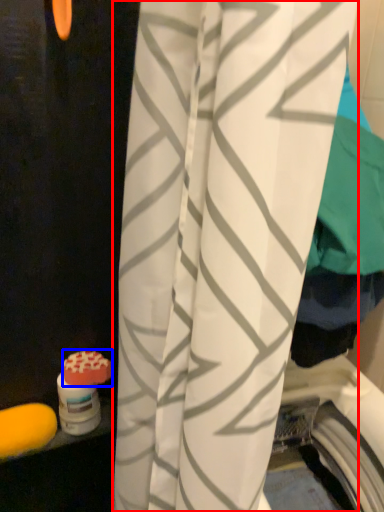
Question: Which point is closer to the camera, curtain (highlighted by a red box) or soap (highlighted by a blue box)?

Choices:
 (A) curtain
 (B) soap

Answer: (A)